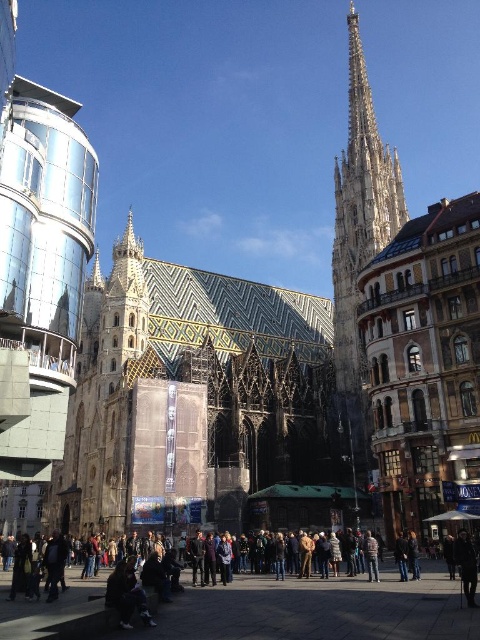
You are a tourist standing in front of the cathedral and notice both the dark brown leather jacket at lower center and the light brown stone tower at center right. Which object is nearer to you?

The dark brown leather jacket at lower center is closer to the viewer than the light brown stone tower at center right.

You are a photographer standing in the bustling urban scene with the cathedral and modern building. You want to capture a photo of the dark brown leather jacket at lower center. According to the coordinates, where should you aim your camera to ensure the jacket is centered in the photo?

The dark brown leather jacket at lower center is located at coordinates point (316,609), so you should aim your camera at that specific point to center the jacket in the photo.